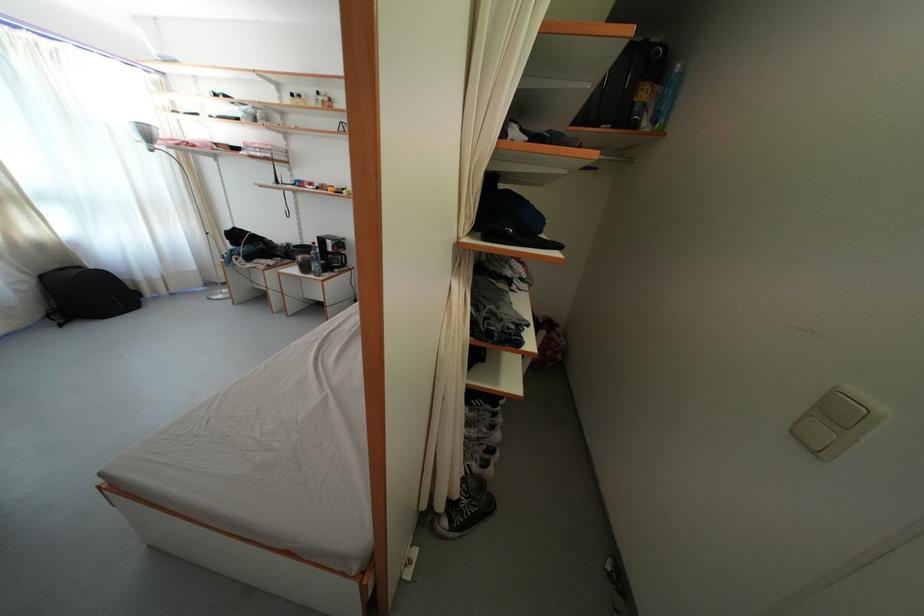
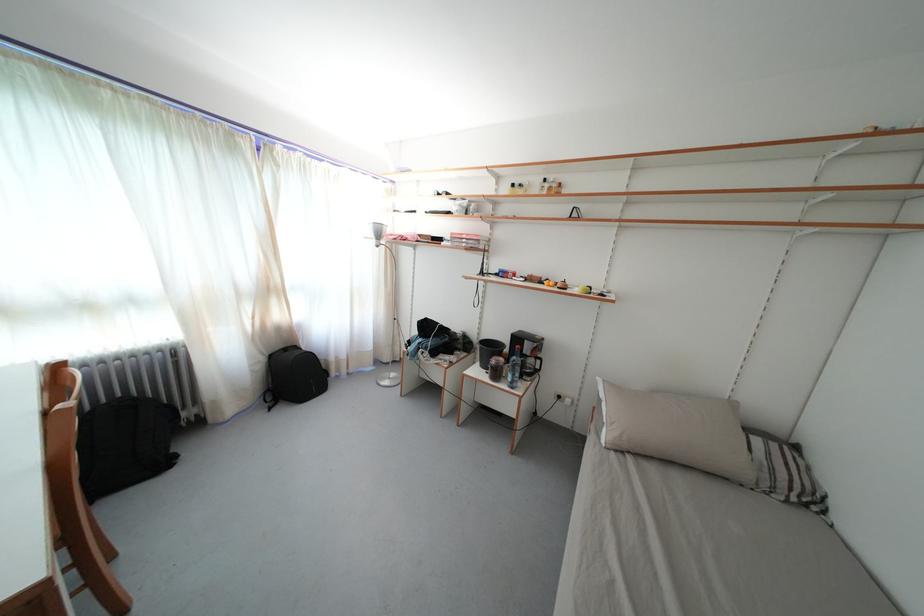
Where in the second image is the point corresponding to pixel 327 246 from the first image?

(524, 345)